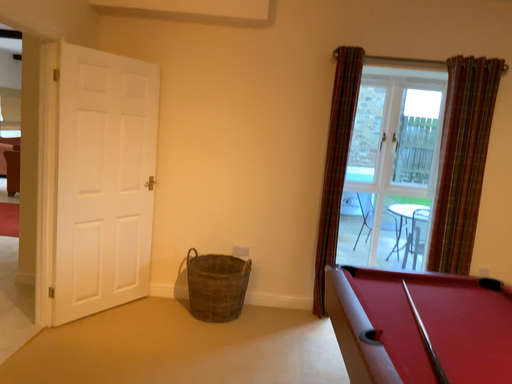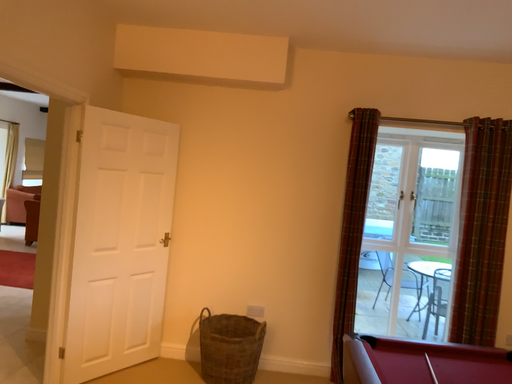
Question: How did the camera likely rotate when shooting the video?

Choices:
 (A) rotated downward
 (B) rotated upward

Answer: (B)